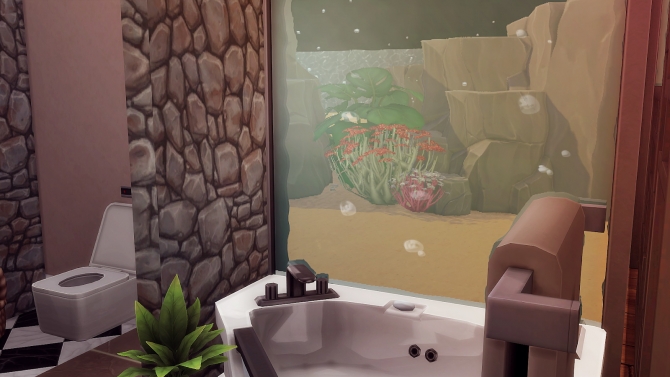
Locate an element on the screen. glass display is located at coordinates (508, 141).